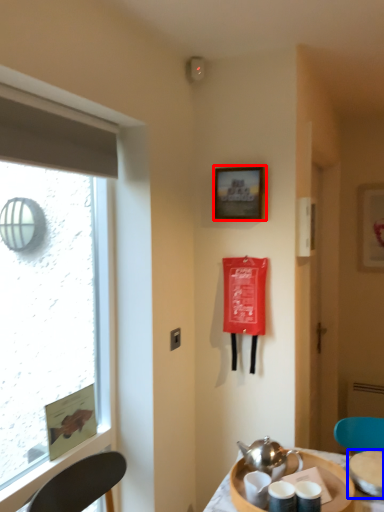
Question: Which of the following is the farthest to the observer, picture frame (highlighted by a red box) or tableware (highlighted by a blue box)?

Choices:
 (A) picture frame
 (B) tableware

Answer: (A)